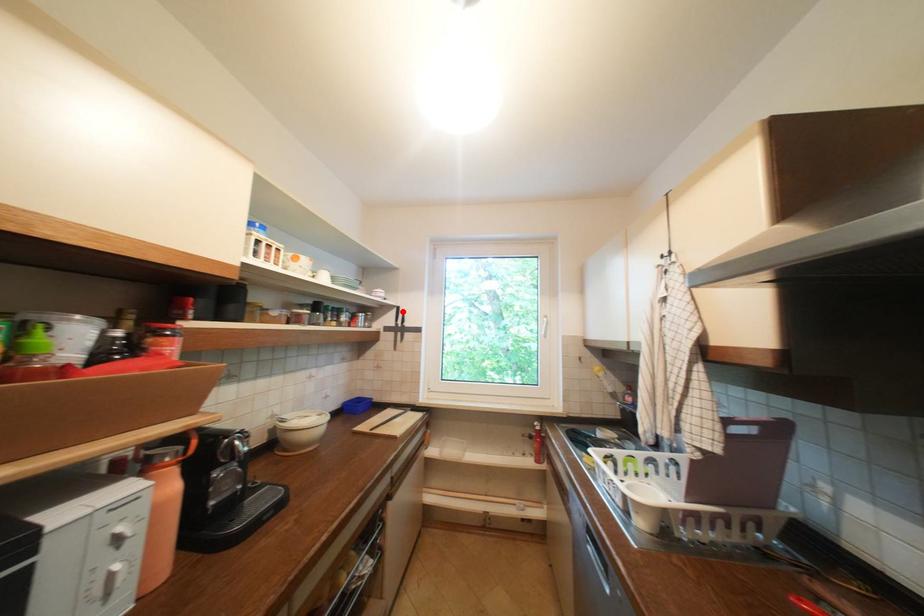
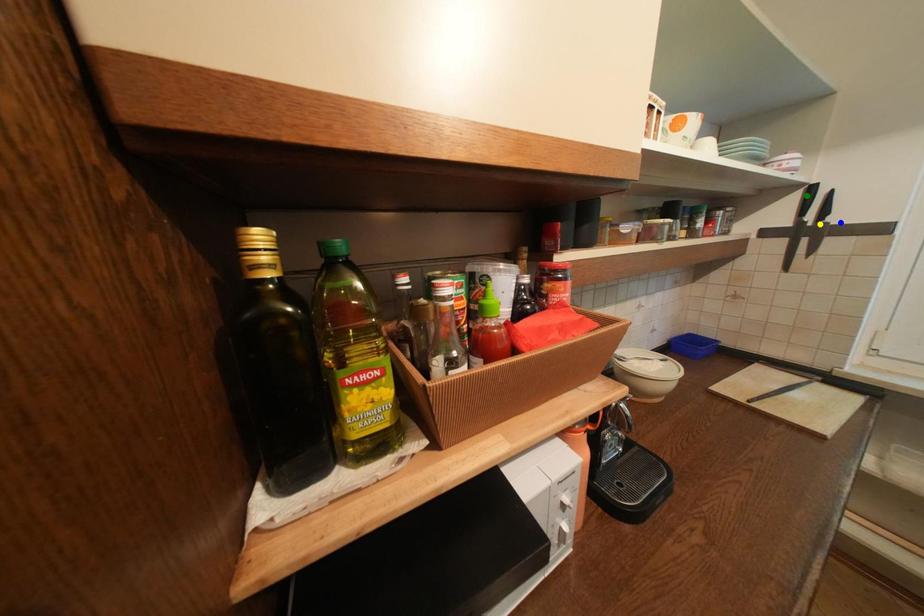
Question: I am providing you with two images of the same scene from different viewpoints. A red point is marked on the first image. You are given multiple points on the second image. Which point in image 2 is actually the same real-world point as the red point in image 1?

Choices:
 (A) yellow point
 (B) blue point
 (C) green point

Answer: (C)